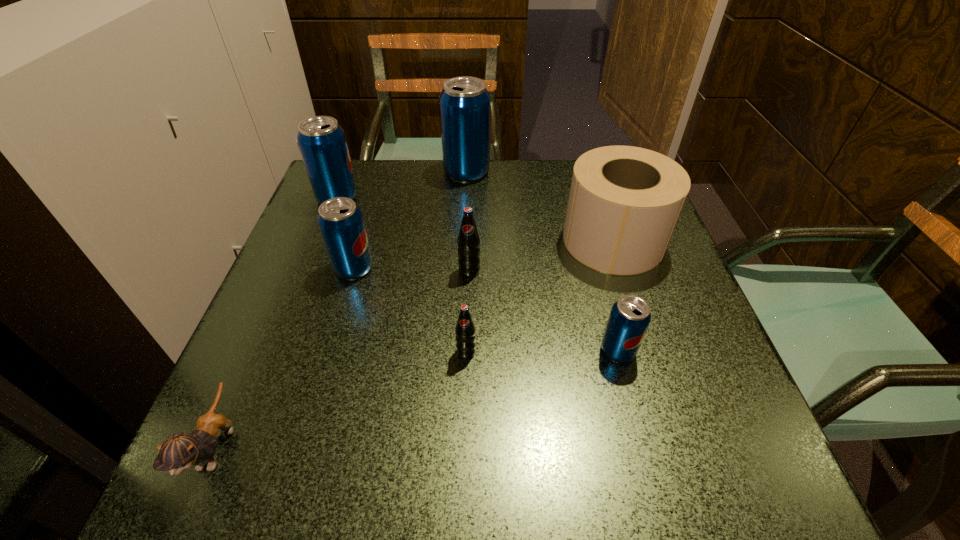
You are a GUI agent. You are given a task and a screenshot of the screen. Output one action in this format:
    pyautogui.click(x=<x>, y=<y>)
    Task: Click on the object that is the fifth closest to the second nearest blue pop soda
    This screenshot has width=960, height=540.
    Given the screenshot: What is the action you would take?
    pyautogui.click(x=465, y=105)

Locate which object ranks third in proximity to the second tallest pop. Please provide its 2D coordinates. Your answer should be formatted as a tuple, i.e. [(x, y)], where the tuple contains the x and y coordinates of a point satisfying the conditions above.

[(468, 241)]

Choose which pop is the second nearest neighbor to the farther black pop. Please provide its 2D coordinates. Your answer should be formatted as a tuple, i.e. [(x, y)], where the tuple contains the x and y coordinates of a point satisfying the conditions above.

[(340, 221)]

The width and height of the screenshot is (960, 540). I want to click on pop that can be found as the closest to the farthest object, so click(322, 142).

Identify which blue pop soda is located as the nearest to the farthest pop. Please provide its 2D coordinates. Your answer should be formatted as a tuple, i.e. [(x, y)], where the tuple contains the x and y coordinates of a point satisfying the conditions above.

[(322, 142)]

Point out which blue pop soda is positioned as the second nearest to the nearer black pop. Please provide its 2D coordinates. Your answer should be formatted as a tuple, i.e. [(x, y)], where the tuple contains the x and y coordinates of a point satisfying the conditions above.

[(340, 221)]

Identify the location of free space that satisfies the following two spatial constraints: 1. on the front side of the biggest blue pop soda; 2. on the right side of the toilet tissue. The width and height of the screenshot is (960, 540). (464, 240).

You are a GUI agent. You are given a task and a screenshot of the screen. Output one action in this format:
    pyautogui.click(x=<x>, y=<y>)
    Task: Click on the vacant space that satisfies the following two spatial constraints: 1. on the front label of the bigger black pop; 2. on the left side of the nearest blue pop soda
    Image resolution: width=960 pixels, height=540 pixels.
    Given the screenshot: What is the action you would take?
    pyautogui.click(x=468, y=350)